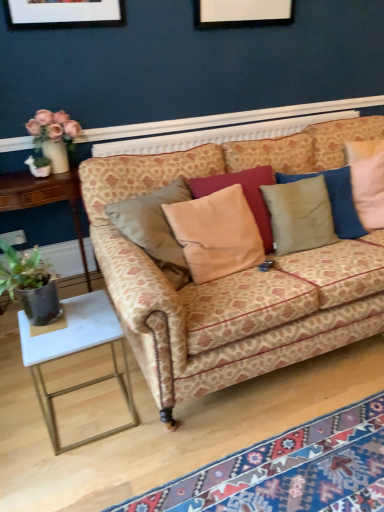
What is the approximate width of carpet with geometric patterns at lower right?

carpet with geometric patterns at lower right is 16.39 inches in width.

Image resolution: width=384 pixels, height=512 pixels. In order to click on matte ceramic vase at upper left in this screenshot , I will do `click(54, 136)`.

The image size is (384, 512). I want to click on white marble table at left, the 2th table when ordered from front to back, so 44,198.

What are the coordinates of `white marble side table at lower left, which is the first table in front-to-back order` in the screenshot? It's located at (77, 352).

At what (x,y) coordinates should I click in order to perform the action: click on beige fabric pillow at center, which is counted as the 2th pillow, starting from the right. Please return your answer as a coordinate pair (x, y). The width and height of the screenshot is (384, 512). Looking at the image, I should click on (216, 234).

From a real-world perspective, is velvet beige pillow at center, which ranks as the second pillow in left-to-right order, physically above matte ceramic vase at upper left?

Incorrect, from a real-world perspective, velvet beige pillow at center, which ranks as the second pillow in left-to-right order, is lower than matte ceramic vase at upper left.

Is the surface of velvet beige pillow at center, which appears as the first pillow when viewed from the right, in direct contact with matte ceramic vase at upper left?

No, velvet beige pillow at center, which appears as the first pillow when viewed from the right, is not with matte ceramic vase at upper left.

Where is `pillow that is the 1st object located below the matte ceramic vase at upper left (from the image's perspective)`? The width and height of the screenshot is (384, 512). pillow that is the 1st object located below the matte ceramic vase at upper left (from the image's perspective) is located at coordinates (300, 215).

Between patterned fabric couch at center and carpet with geometric patterns at lower right, which one has smaller size?

carpet with geometric patterns at lower right is smaller.

Would you say patterned fabric couch at center is outside carpet with geometric patterns at lower right?

Indeed, patterned fabric couch at center is completely outside carpet with geometric patterns at lower right.

Which object is positioned more to the left, patterned fabric couch at center or carpet with geometric patterns at lower right?

carpet with geometric patterns at lower right.

Between patterned fabric couch at center and carpet with geometric patterns at lower right, which one has less height?

With less height is carpet with geometric patterns at lower right.

Is beige fabric pillow at center, which appears as the first pillow when viewed from the left, touching patterned fabric couch at center?

No.

This screenshot has width=384, height=512. There is a patterned fabric couch at center. Identify the location of the 1st pillow above it (from the image's perspective). (216, 234).

Is beige fabric pillow at center, which appears as the first pillow when viewed from the left, bigger or smaller than patterned fabric couch at center?

Clearly, beige fabric pillow at center, which appears as the first pillow when viewed from the left, is smaller in size than patterned fabric couch at center.

Does carpet with geometric patterns at lower right have a lesser height compared to white marble table at left, which is counted as the first table, starting from the back?

Yes.

You are a GUI agent. You are given a task and a screenshot of the screen. Output one action in this format:
    pyautogui.click(x=<x>, y=<y>)
    Task: Click on the 2nd table behind the carpet with geometric patterns at lower right, counting from the anchor's position
    
    Given the screenshot: What is the action you would take?
    pyautogui.click(x=44, y=198)

Is carpet with geometric patterns at lower right facing towards white marble table at left, which is counted as the first table, starting from the back?

No, carpet with geometric patterns at lower right is not oriented towards white marble table at left, which is counted as the first table, starting from the back.

Could you measure the distance between carpet with geometric patterns at lower right and white marble table at left, the 1th table positioned from the top?

carpet with geometric patterns at lower right and white marble table at left, the 1th table positioned from the top, are 1.54 meters apart from each other.

Which point is more distant from viewer, (175, 494) or (79, 129)?

The point (79, 129) is more distant.

Can you confirm if carpet with geometric patterns at lower right is wider than matte ceramic vase at upper left?

Yes, carpet with geometric patterns at lower right is wider than matte ceramic vase at upper left.

Which of these two, carpet with geometric patterns at lower right or matte ceramic vase at upper left, is bigger?

carpet with geometric patterns at lower right.

From the image's perspective, which one is positioned lower, dark green leafy plant at left or beige fabric pillow at center, which appears as the first pillow when viewed from the left?

dark green leafy plant at left, from the image's perspective.

Considering the relative sizes of dark green leafy plant at left and beige fabric pillow at center, which appears as the first pillow when viewed from the left, in the image provided, is dark green leafy plant at left shorter than beige fabric pillow at center, which appears as the first pillow when viewed from the left,?

Yes, dark green leafy plant at left is shorter than beige fabric pillow at center, which appears as the first pillow when viewed from the left.

Identify the location of pillow that is the 1st one when counting rightward from the dark green leafy plant at left. (216, 234).

From a real-world perspective, is carpet with geometric patterns at lower right located beneath white marble side table at lower left, which is the first table in front-to-back order?

Yes, from a real-world perspective, carpet with geometric patterns at lower right is under white marble side table at lower left, which is the first table in front-to-back order.

Considering the relative sizes of carpet with geometric patterns at lower right and white marble side table at lower left, the 2th table from the top, in the image provided, is carpet with geometric patterns at lower right taller than white marble side table at lower left, the 2th table from the top,?

No.

Are carpet with geometric patterns at lower right and white marble side table at lower left, placed as the first table when sorted from bottom to top, located far from each other?

They are positioned close to each other.

Is carpet with geometric patterns at lower right to the left or to the right of white marble side table at lower left, the 2th table from the top, in the image?

Clearly, carpet with geometric patterns at lower right is on the right of white marble side table at lower left, the 2th table from the top, in the image.

Find the location of a particular element. This screenshot has height=512, width=384. the 2nd pillow below the matte ceramic vase at upper left (from a real-world perspective) is located at coordinates (300, 215).

This screenshot has width=384, height=512. Find the location of `mat in front of the patterned fabric couch at center`. mat in front of the patterned fabric couch at center is located at coordinates (289, 470).

When comparing their distances from patterned fabric couch at center, does velvet beige pillow at center, which appears as the first pillow when viewed from the right, or matte ceramic vase at upper left seem further?

matte ceramic vase at upper left lies further to patterned fabric couch at center than the other object.

Consider the image. Estimate the real-world distances between objects in this image. Which object is further from white marble side table at lower left, the 2th table from the top, velvet beige pillow at center, which ranks as the second pillow in left-to-right order, or beige fabric pillow at center, which is counted as the 2th pillow, starting from the right?

velvet beige pillow at center, which ranks as the second pillow in left-to-right order, lies further to white marble side table at lower left, the 2th table from the top, than the other object.

Estimate the real-world distances between objects in this image. Which object is further from carpet with geometric patterns at lower right, matte ceramic vase at upper left or velvet beige pillow at center, which ranks as the second pillow in left-to-right order?

matte ceramic vase at upper left.

Based on their spatial positions, is velvet beige pillow at center, which ranks as the second pillow in left-to-right order, or patterned fabric couch at center closer to white marble table at left, which is counted as the first table, starting from the back?

Based on the image, patterned fabric couch at center appears to be nearer to white marble table at left, which is counted as the first table, starting from the back.

When comparing their distances from white marble table at left, the 2th table when ordered from front to back, does carpet with geometric patterns at lower right or velvet beige pillow at center, which ranks as the second pillow in left-to-right order, seem further?

carpet with geometric patterns at lower right is further to white marble table at left, the 2th table when ordered from front to back.

Which object lies nearer to the anchor point white marble side table at lower left, which is the first table in front-to-back order, dark green leafy plant at left or white marble table at left, the 2th table when ordered from front to back?

dark green leafy plant at left is closer to white marble side table at lower left, which is the first table in front-to-back order.

Based on their spatial positions, is matte ceramic vase at upper left or white marble table at left, the 2th table when ordered from front to back, further from patterned fabric couch at center?

matte ceramic vase at upper left is further to patterned fabric couch at center.

Which object lies further to the anchor point beige fabric pillow at center, which appears as the first pillow when viewed from the left, dark green leafy plant at left or patterned fabric couch at center?

dark green leafy plant at left lies further to beige fabric pillow at center, which appears as the first pillow when viewed from the left, than the other object.

The image size is (384, 512). I want to click on houseplant between white marble table at left, the 1th table positioned from the top, and patterned fabric couch at center, so click(30, 284).

At what (x,y) coordinates should I click in order to perform the action: click on table between matte ceramic vase at upper left and patterned fabric couch at center. Please return your answer as a coordinate pair (x, y). Looking at the image, I should click on (77, 352).

Identify the location of mat between dark green leafy plant at left and velvet beige pillow at center, which ranks as the second pillow in left-to-right order, in the horizontal direction. (289, 470).

This screenshot has width=384, height=512. Identify the location of mat situated between white marble side table at lower left, marked as the second table in a back-to-front arrangement, and patterned fabric couch at center from left to right. (289, 470).